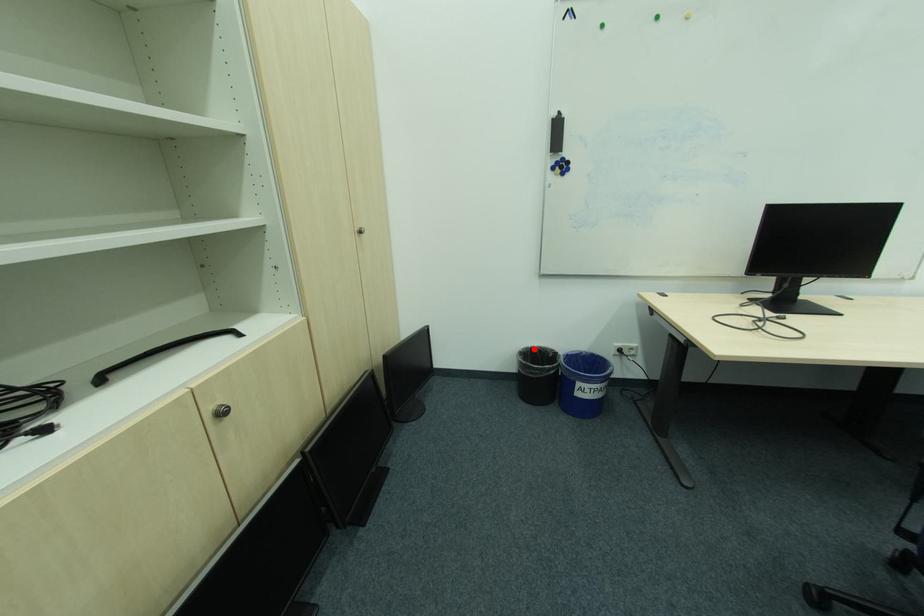
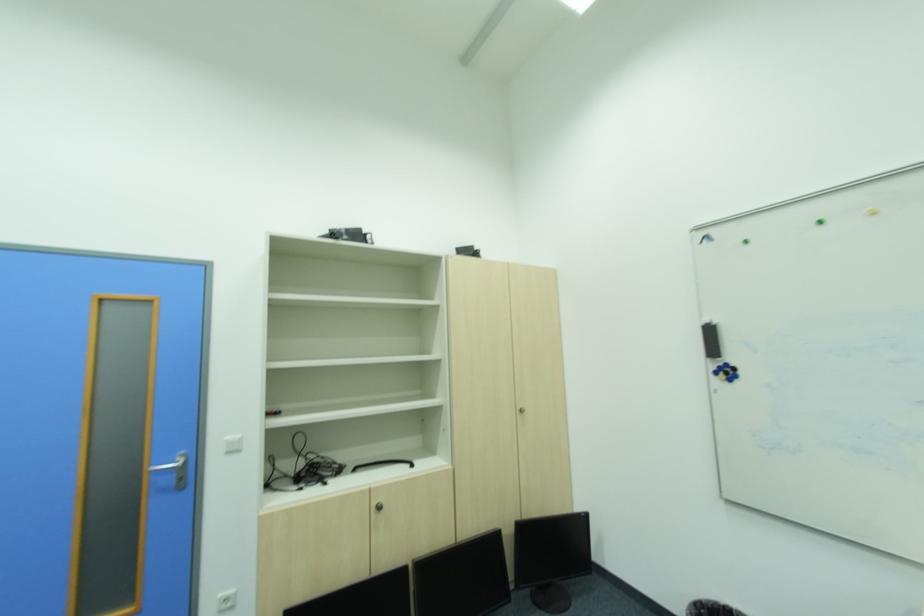
Locate, in the second image, the point that corresponds to the highlighted location in the first image.

(723, 604)